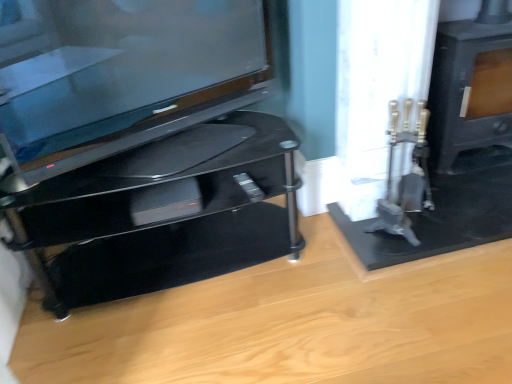
Question: Based on their sizes in the image, would you say black glossy tv stand at left is bigger or smaller than matte black stove at right?

Choices:
 (A) big
 (B) small

Answer: (A)

Question: Is black glossy tv stand at left in front of or behind matte black stove at right in the image?

Choices:
 (A) front
 (B) behind

Answer: (A)

Question: Which object is the farthest from the glossy black tv at left?

Choices:
 (A) matte black stove at right
 (B) black glossy tv stand at left

Answer: (A)

Question: Estimate the real-world distances between objects in this image. Which object is farther from the matte black stove at right?

Choices:
 (A) black glossy tv stand at left
 (B) glossy black tv at left

Answer: (B)